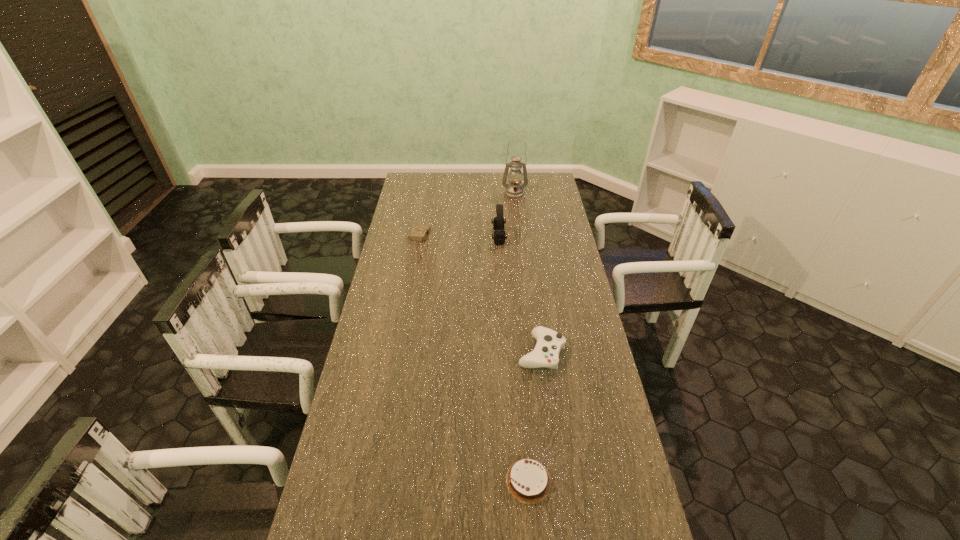
In the image, there is a desktop. Where is `vacant area at the left edge`? This screenshot has height=540, width=960. vacant area at the left edge is located at coordinates (396, 237).

Identify the location of vacant area at the right edge. (610, 517).

I want to click on free spot between the nearest object and the diary, so click(x=474, y=359).

I want to click on unoccupied position between the chocolate cake and the oil lamp, so click(521, 337).

The height and width of the screenshot is (540, 960). What are the coordinates of `vacant space in between the chocolate cake and the fourth shortest object` in the screenshot? It's located at (514, 359).

This screenshot has height=540, width=960. Identify the location of vacant space that is in between the fourth shortest object and the chocolate cake. (514, 359).

Where is `vacant area that lies between the farthest object and the fourth shortest object`? vacant area that lies between the farthest object and the fourth shortest object is located at coordinates (507, 215).

The image size is (960, 540). I want to click on vacant point located between the control and the diary, so point(480,294).

I want to click on free space between the control and the chocolate cake, so click(x=535, y=416).

Find the location of `vacant area that lies between the oil lamp and the headset`. vacant area that lies between the oil lamp and the headset is located at coordinates (507, 215).